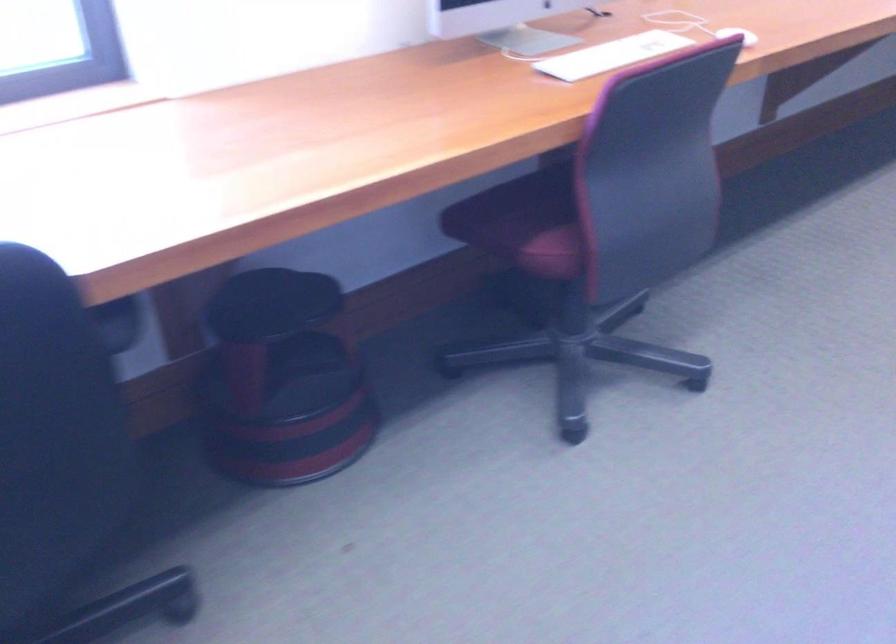
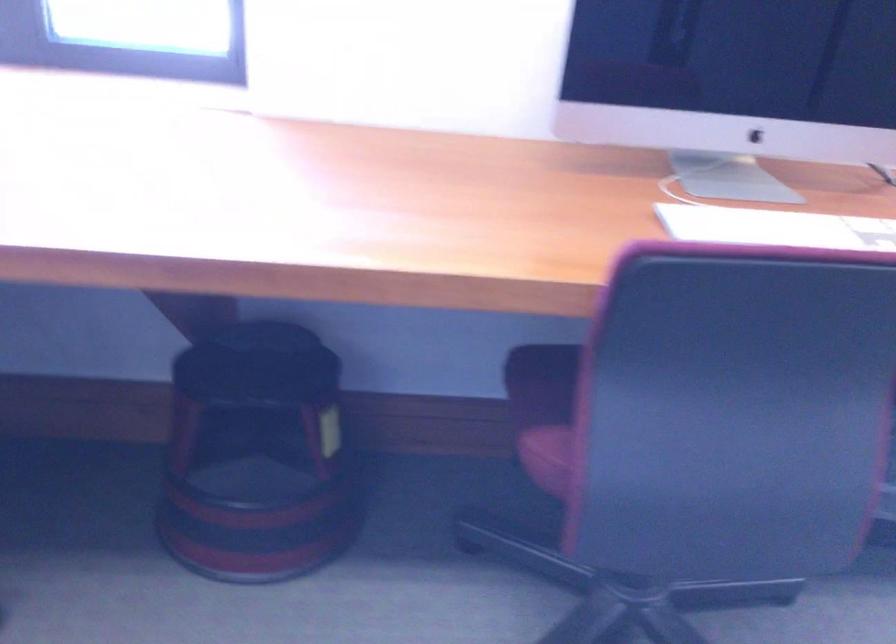
Question: Based on the continuous images, in which direction is the camera rotating? Reply with the corresponding letter.

Choices:
 (A) Left
 (B) Right
 (C) Up
 (D) Down

Answer: (A)